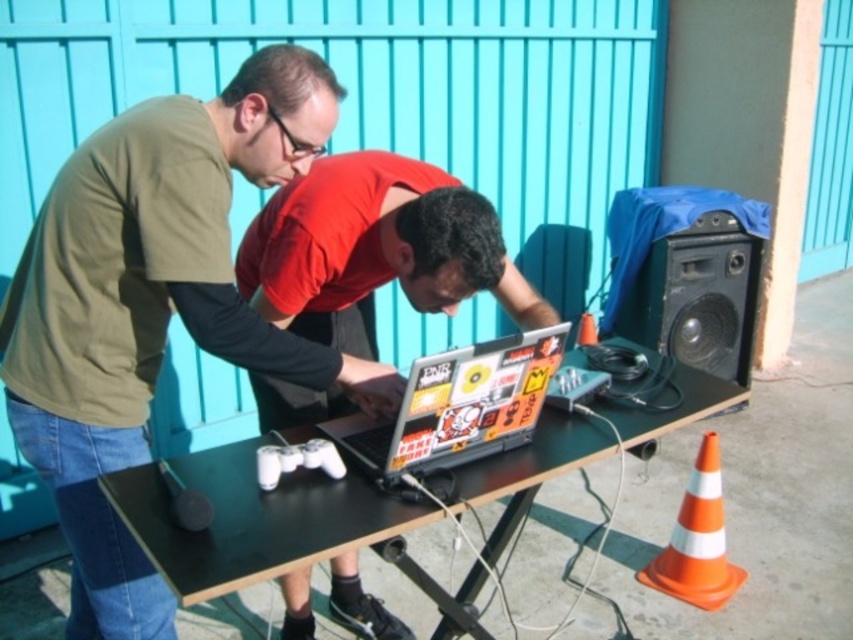
Question: Estimate the real-world distances between objects in this image. Which object is closer to the shiny red shirt at center?

Choices:
 (A) black plastic table at center
 (B) orange/white striped traffic cone at lower right

Answer: (A)

Question: In this image, where is matte black laptop at center located relative to orange/white striped traffic cone at lower right?

Choices:
 (A) right
 (B) left

Answer: (B)

Question: Estimate the real-world distances between objects in this image. Which object is farther from the shiny red shirt at center?

Choices:
 (A) black plastic table at center
 (B) matte black laptop at center

Answer: (A)

Question: Is black plastic table at center further to camera compared to green matte speaker at right?

Choices:
 (A) yes
 (B) no

Answer: (B)

Question: Which point is farther to the camera?

Choices:
 (A) sticker-covered plastic laptop at center
 (B) black plastic table at center
 (C) shiny red shirt at center

Answer: (C)

Question: Does black plastic table at center appear under green matte speaker at right?

Choices:
 (A) no
 (B) yes

Answer: (B)